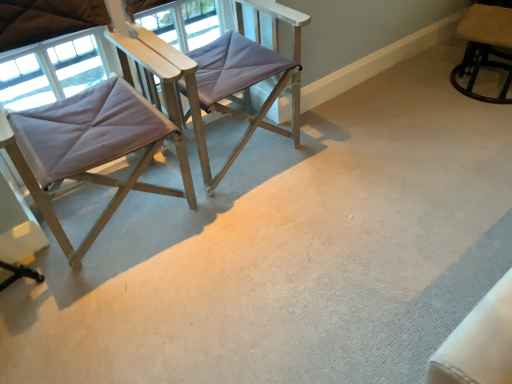
The width and height of the screenshot is (512, 384). I want to click on vacant area to the right of matte gray fabric chair at left, placed as the 3th chair when sorted from right to left, so click(x=249, y=241).